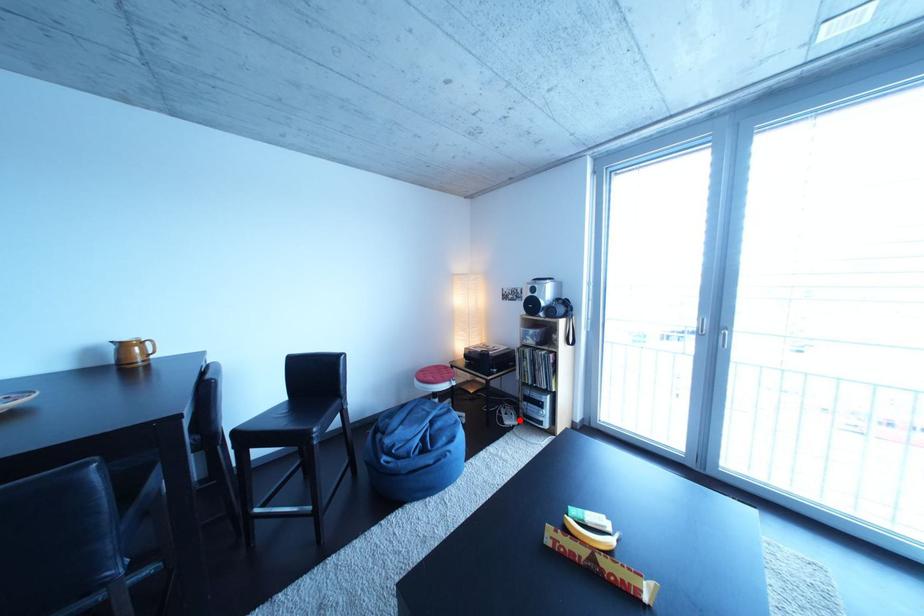
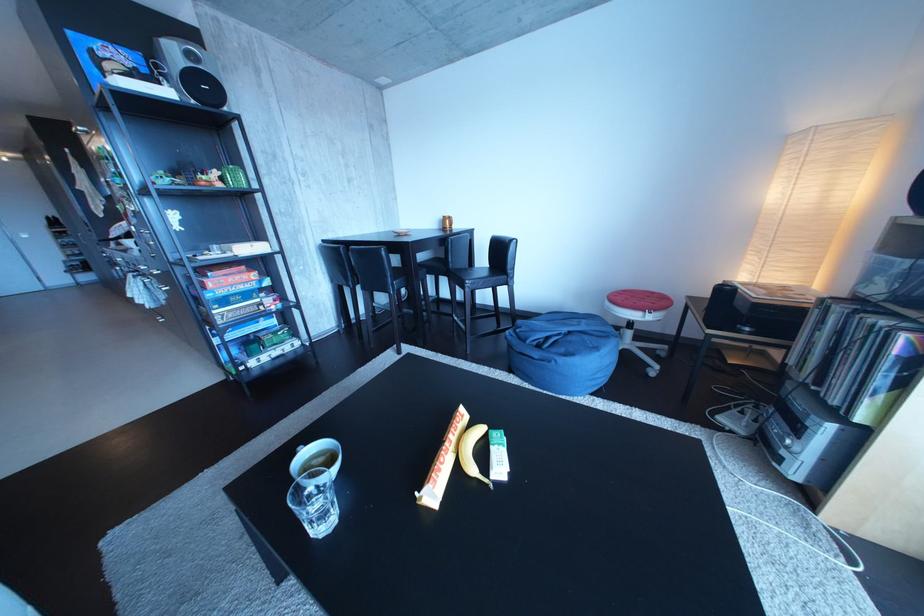
Where in the second image is the point corresponding to the highlighted location from the first image?

(755, 419)